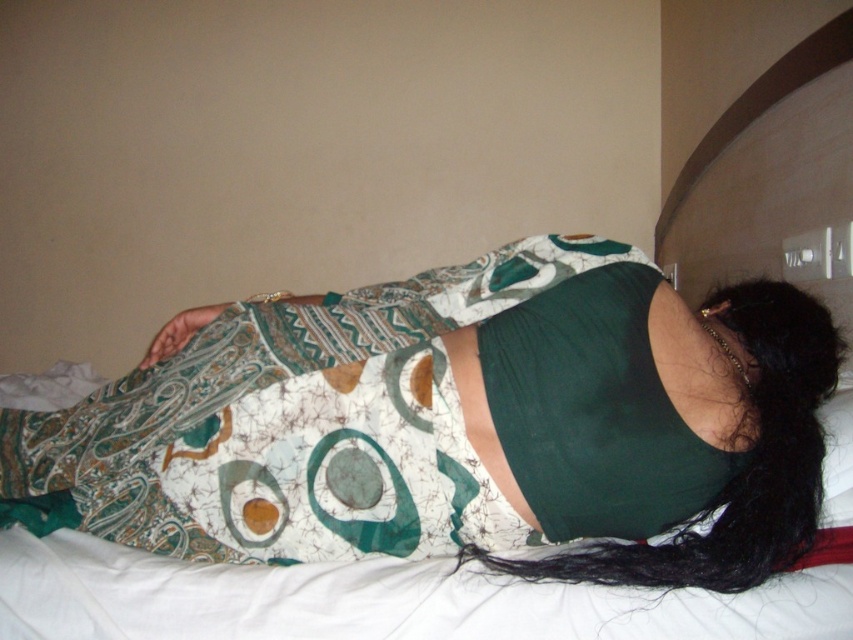
Does printed fabric dress at center come behind black silky hair at center?

Yes.

Which is below, printed fabric dress at center or black silky hair at center?

Positioned lower is printed fabric dress at center.

Find the location of a particular element. Image resolution: width=853 pixels, height=640 pixels. printed fabric dress at center is located at coordinates (460, 426).